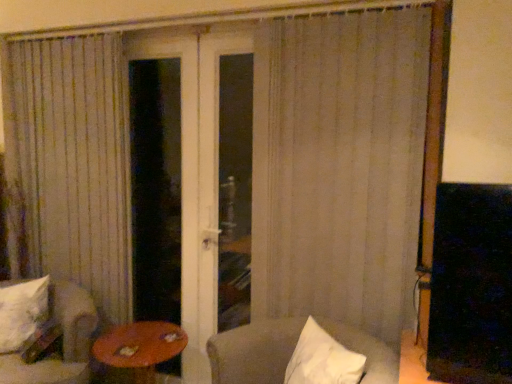
At what (x,y) coordinates should I click in order to perform the action: click on empty space that is ontop of transparent glass door at center (from a real-world perspective). Please return your answer as a coordinate pair (x, y). The image size is (512, 384). Looking at the image, I should click on (150, 35).